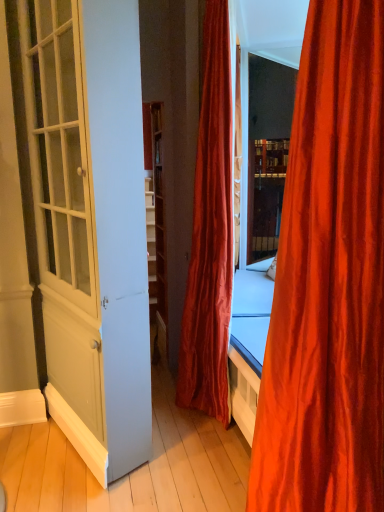
Question: Should I look upward or downward to see white glossy door at left?

Choices:
 (A) down
 (B) up

Answer: (B)

Question: Is velvet red curtain at center, which is the 1th curtain from back to front, outside of white glossy door at left?

Choices:
 (A) yes
 (B) no

Answer: (A)

Question: Is velvet red curtain at center, which is the 1th curtain from back to front, bigger than white glossy door at left?

Choices:
 (A) yes
 (B) no

Answer: (B)

Question: Is velvet red curtain at center, which is the 1th curtain from back to front, at the left side of white glossy door at left?

Choices:
 (A) no
 (B) yes

Answer: (A)

Question: Is white glossy door at left located within velvet red curtain at center, which is the 1th curtain from back to front?

Choices:
 (A) yes
 (B) no

Answer: (B)

Question: Does velvet red curtain at center, which is the 1th curtain from back to front, have a greater height compared to white glossy door at left?

Choices:
 (A) yes
 (B) no

Answer: (A)

Question: From a real-world perspective, does velvet red curtain at center, which appears as the second curtain when viewed from the front, sit lower than white glossy door at left?

Choices:
 (A) yes
 (B) no

Answer: (B)

Question: Is silky orange curtain at right, the first curtain in the front-to-back sequence, at the left side of white glossy door at left?

Choices:
 (A) no
 (B) yes

Answer: (A)

Question: Considering the relative sizes of silky orange curtain at right, arranged as the second curtain when viewed from the back, and white glossy door at left in the image provided, is silky orange curtain at right, arranged as the second curtain when viewed from the back, smaller than white glossy door at left?

Choices:
 (A) yes
 (B) no

Answer: (A)

Question: Can you confirm if silky orange curtain at right, arranged as the second curtain when viewed from the back, is wider than white glossy door at left?

Choices:
 (A) no
 (B) yes

Answer: (B)

Question: From the image's perspective, is silky orange curtain at right, the first curtain in the front-to-back sequence, over white glossy door at left?

Choices:
 (A) no
 (B) yes

Answer: (A)

Question: From a real-world perspective, is silky orange curtain at right, arranged as the second curtain when viewed from the back, on white glossy door at left?

Choices:
 (A) no
 (B) yes

Answer: (A)

Question: Does silky orange curtain at right, the first curtain in the front-to-back sequence, come behind white glossy door at left?

Choices:
 (A) yes
 (B) no

Answer: (B)

Question: Does silky orange curtain at right, the first curtain in the front-to-back sequence, lie behind velvet red curtain at center, which is the 1th curtain from back to front?

Choices:
 (A) yes
 (B) no

Answer: (B)